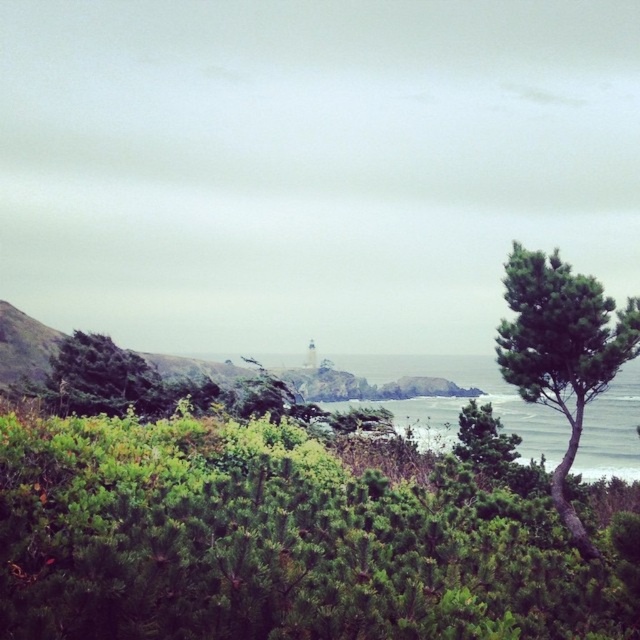
Between green leafy tree at right and green textured tree at center-right, which one is positioned higher?

green leafy tree at right is above.

Does green leafy tree at right have a greater height compared to green textured tree at center-right?

Correct, green leafy tree at right is much taller as green textured tree at center-right.

This screenshot has height=640, width=640. What do you see at coordinates (561, 349) in the screenshot?
I see `green leafy tree at right` at bounding box center [561, 349].

In order to click on green leafy tree at right in this screenshot , I will do `click(561, 349)`.

Is green leafy tree at right further to the viewer compared to green leafy tree at left?

No, green leafy tree at right is closer to the viewer.

Is green leafy tree at right to the right of green leafy tree at left from the viewer's perspective?

Yes, green leafy tree at right is to the right of green leafy tree at left.

The width and height of the screenshot is (640, 640). Describe the element at coordinates (561, 349) in the screenshot. I see `green leafy tree at right` at that location.

The height and width of the screenshot is (640, 640). What are the coordinates of `green leafy tree at right` in the screenshot? It's located at (561, 349).

Is green leafy tree at left smaller than green textured tree at center-right?

No, green leafy tree at left is not smaller than green textured tree at center-right.

Is point (122, 381) positioned before point (484, 435)?

No, it is behind (484, 435).

Between point (106, 352) and point (477, 435), which one is positioned in front?

Point (477, 435) is in front.

This screenshot has height=640, width=640. I want to click on green leafy tree at left, so click(x=100, y=380).